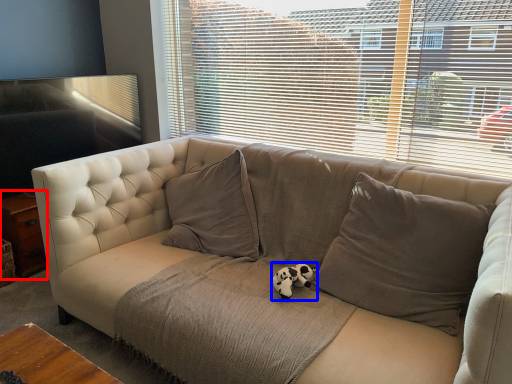
Question: Among these objects, which one is farthest to the camera, table (highlighted by a red box) or animal (highlighted by a blue box)?

Choices:
 (A) table
 (B) animal

Answer: (A)